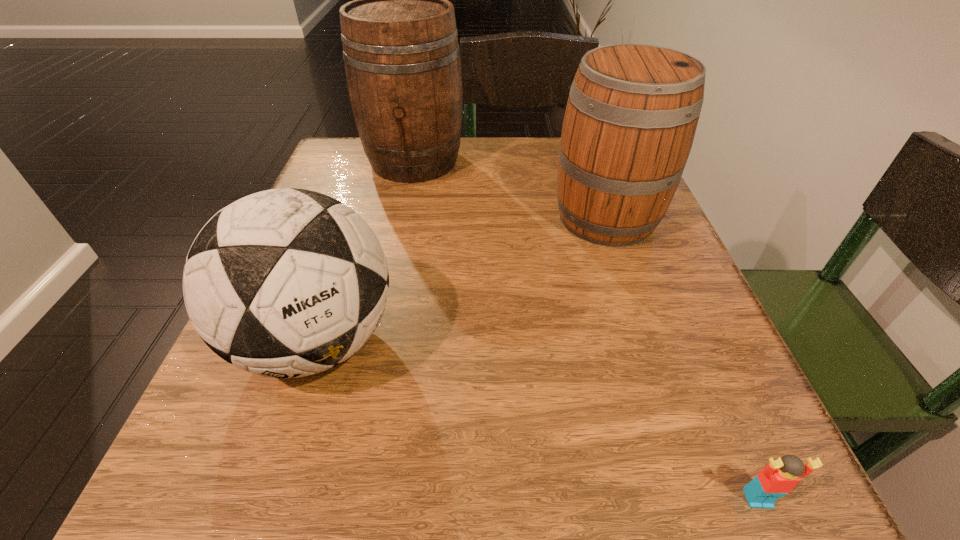
Image resolution: width=960 pixels, height=540 pixels. Identify the location of vacant space at the right edge. [x=627, y=368].

In the image, there is a desktop. Where is `free space at the far left corner`? This screenshot has width=960, height=540. free space at the far left corner is located at coordinates (362, 150).

You are a GUI agent. You are given a task and a screenshot of the screen. Output one action in this format:
    pyautogui.click(x=<x>, y=<y>)
    Task: Click on the vacant point at the near left corner
    Image resolution: width=960 pixels, height=540 pixels.
    Given the screenshot: What is the action you would take?
    pyautogui.click(x=181, y=520)

The width and height of the screenshot is (960, 540). What are the coordinates of `unoccupied position between the second nearest object and the right cider` in the screenshot? It's located at (462, 279).

At what (x,y) coordinates should I click in order to perform the action: click on vacant point located between the third tallest object and the Lego. Please return your answer as a coordinate pair (x, y). Looking at the image, I should click on (538, 420).

Where is `unoccupied area between the third tallest object and the nearest object`? Image resolution: width=960 pixels, height=540 pixels. unoccupied area between the third tallest object and the nearest object is located at coordinates click(x=538, y=420).

Image resolution: width=960 pixels, height=540 pixels. What are the coordinates of `vacant space that's between the right cider and the soccer ball` in the screenshot? It's located at (462, 279).

Locate an element on the screen. The width and height of the screenshot is (960, 540). free space between the right cider and the left cider is located at coordinates (510, 189).

Image resolution: width=960 pixels, height=540 pixels. I want to click on empty location between the right cider and the Lego, so click(682, 358).

Identify which object is the closest to the left cider. Please provide its 2D coordinates. Your answer should be formatted as a tuple, i.e. [(x, y)], where the tuple contains the x and y coordinates of a point satisfying the conditions above.

[(632, 112)]